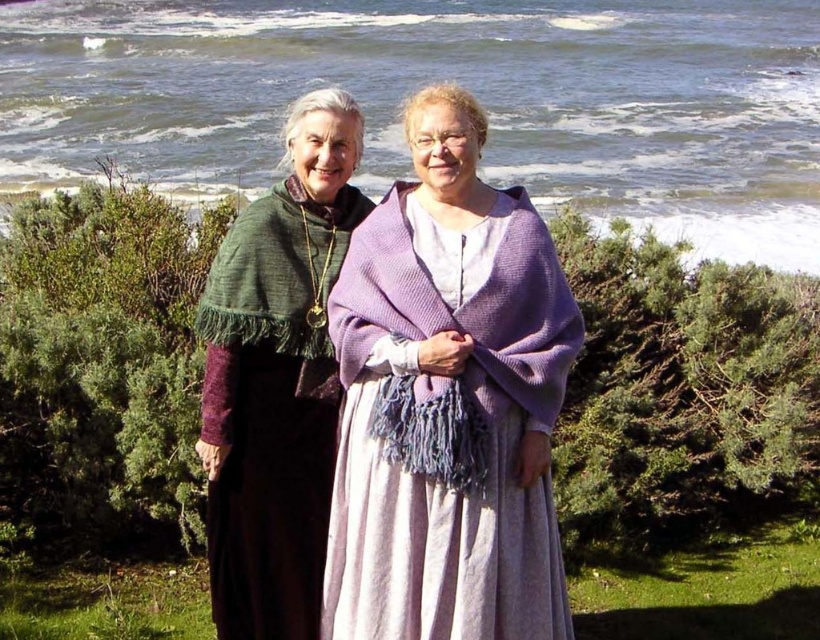
Question: Does lavender knitted shawl at center come in front of green knitted shawl at left?

Choices:
 (A) yes
 (B) no

Answer: (A)

Question: Which point is closer to the camera?

Choices:
 (A) green knitted shawl at left
 (B) lavender knitted shawl at center

Answer: (B)

Question: Is lavender knitted shawl at center bigger than green knitted shawl at left?

Choices:
 (A) no
 (B) yes

Answer: (B)

Question: Is lavender knitted shawl at center above green knitted shawl at left?

Choices:
 (A) no
 (B) yes

Answer: (B)

Question: Which point is farther to the camera?

Choices:
 (A) (262, 474)
 (B) (383, 515)

Answer: (A)